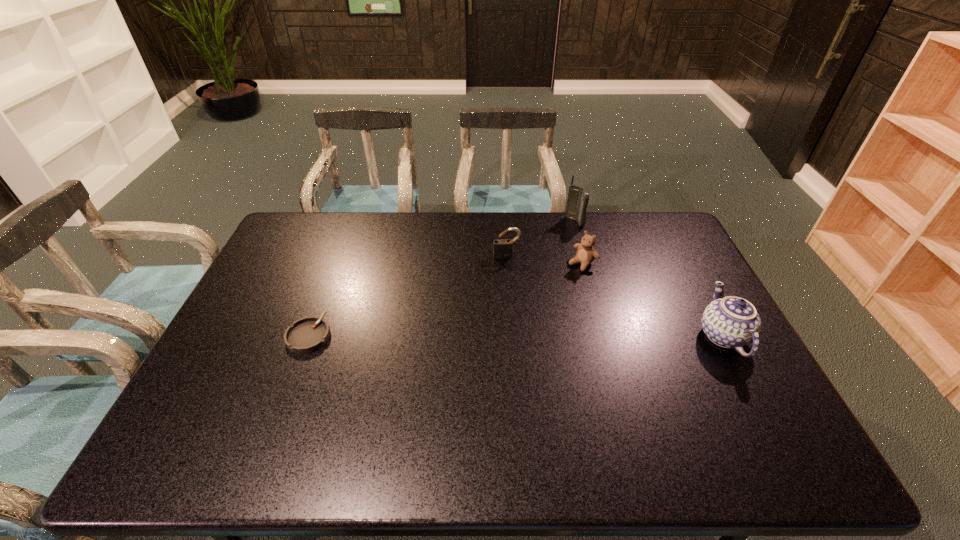
You are a GUI agent. You are given a task and a screenshot of the screen. Output one action in this format:
    pyautogui.click(x=<x>, y=<y>)
    Task: Click on the blank area in the image that satisfies the following two spatial constraints: 1. on the front side of the farthest object; 2. at the spout of the chinaware
    The image size is (960, 540).
    Given the screenshot: What is the action you would take?
    pyautogui.click(x=606, y=336)

Where is `vacant space that satisfies the following two spatial constraints: 1. on the back side of the second object from left to right; 2. on the left side of the tallest object`? This screenshot has width=960, height=540. vacant space that satisfies the following two spatial constraints: 1. on the back side of the second object from left to right; 2. on the left side of the tallest object is located at coordinates (504, 222).